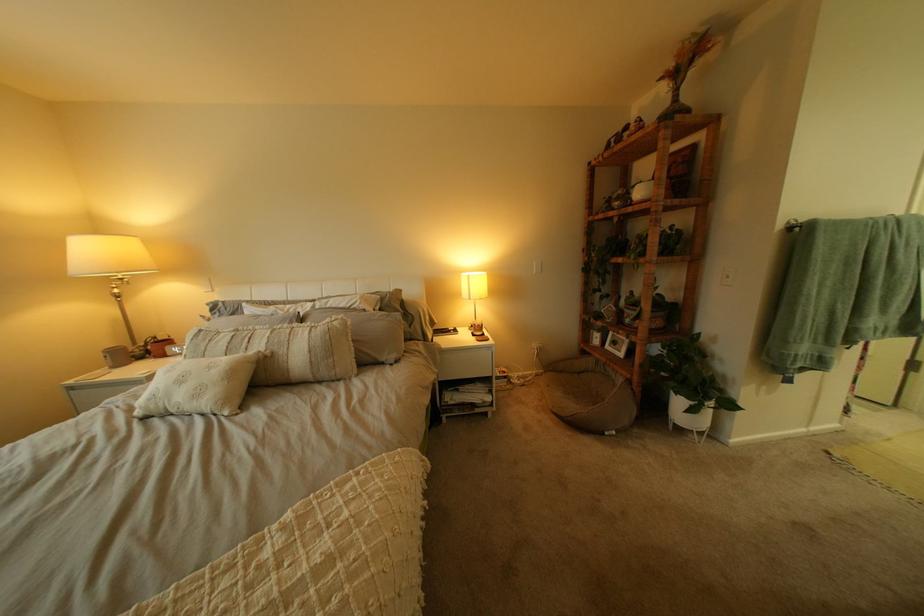
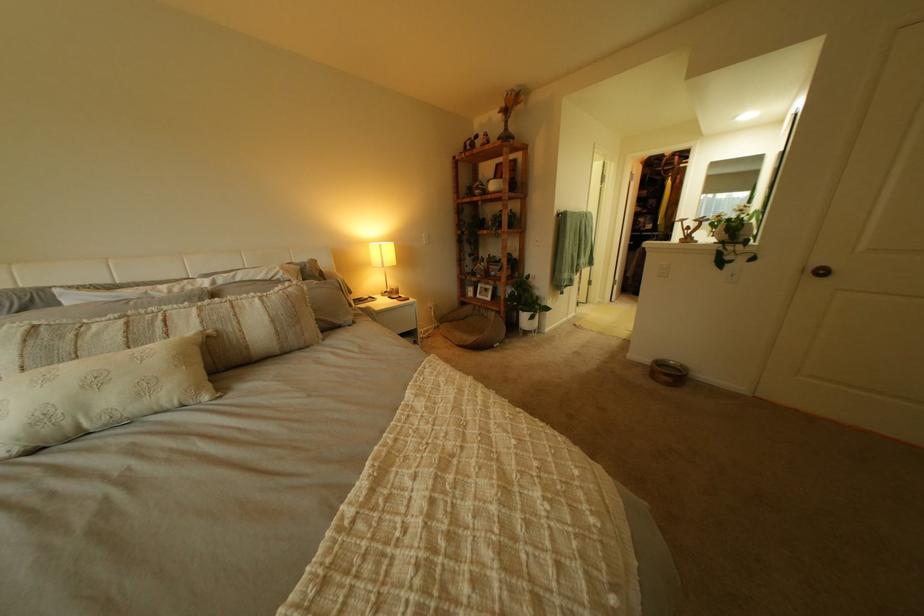
Where in the second image is the point corresponding to pixel 611 347 from the first image?

(485, 300)